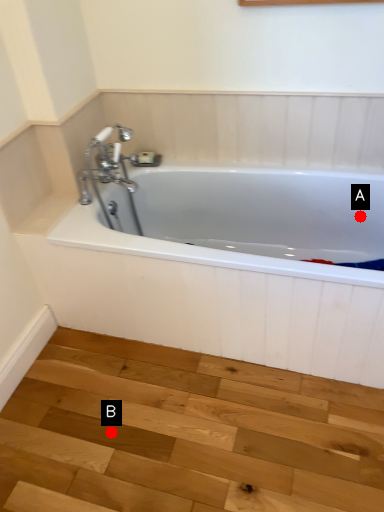
Question: Two points are circled on the image, labeled by A and B beside each circle. Which point is further to the camera?

Choices:
 (A) A is further
 (B) B is further

Answer: (A)